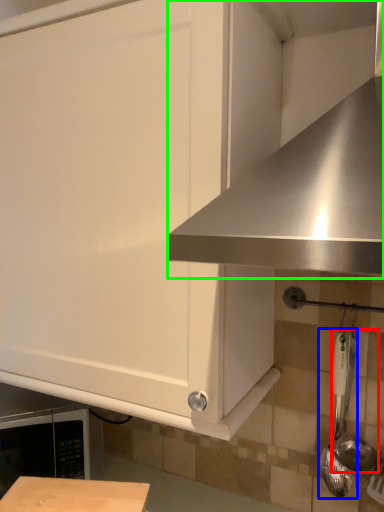
Question: Considering the real-world distances, which object is closest to utensil (highlighted by a red box)? utensil (highlighted by a blue box) or exhaust hood (highlighted by a green box).

Choices:
 (A) utensil
 (B) exhaust hood

Answer: (A)